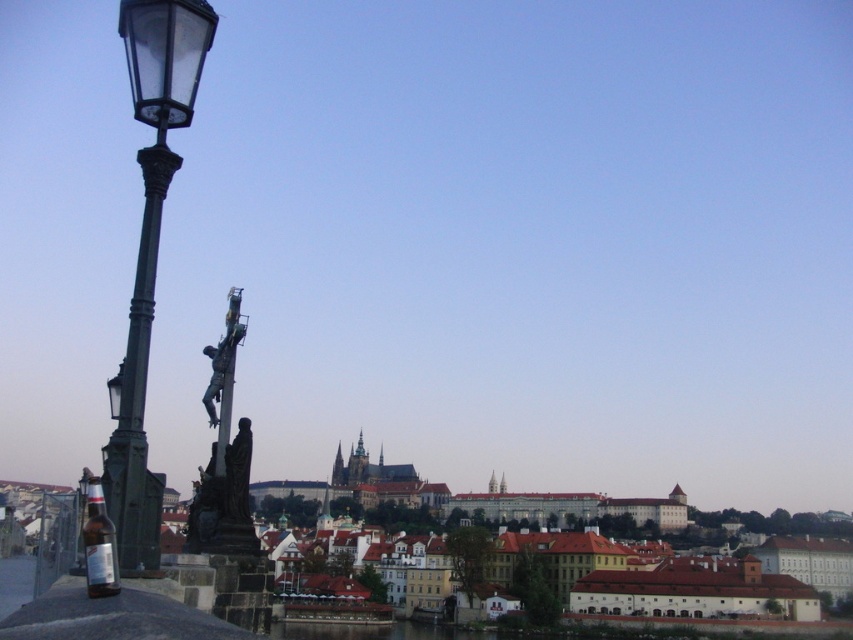
How distant is matte black street light at left from translucent glass bottle at lower left?

They are 7.65 feet apart.

The image size is (853, 640). What do you see at coordinates (149, 252) in the screenshot?
I see `matte black street light at left` at bounding box center [149, 252].

Locate an element on the screen. This screenshot has width=853, height=640. matte black street light at left is located at coordinates (149, 252).

Between black metal pole at left and translucent glass bottle at lower left, which one is positioned higher?

black metal pole at left

Between black metal pole at left and translucent glass bottle at lower left, which one appears on the left side from the viewer's perspective?

black metal pole at left

Identify the location of black metal pole at left. This screenshot has width=853, height=640. (138, 388).

Who is taller, matte black street light at left or black metal pole at left?

matte black street light at left

Can you confirm if matte black street light at left is thinner than black metal pole at left?

In fact, matte black street light at left might be wider than black metal pole at left.

This screenshot has width=853, height=640. What do you see at coordinates (149, 252) in the screenshot? I see `matte black street light at left` at bounding box center [149, 252].

You are a GUI agent. You are given a task and a screenshot of the screen. Output one action in this format:
    pyautogui.click(x=<x>, y=<y>)
    Task: Click on the matte black street light at left
    This screenshot has height=640, width=853.
    Given the screenshot: What is the action you would take?
    pyautogui.click(x=149, y=252)